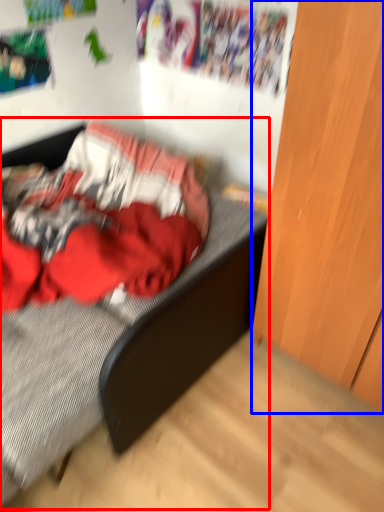
Question: Which point is closer to the camera, bed (highlighted by a red box) or dresser (highlighted by a blue box)?

Choices:
 (A) bed
 (B) dresser

Answer: (B)